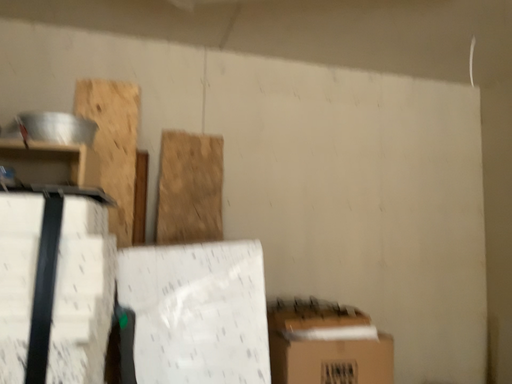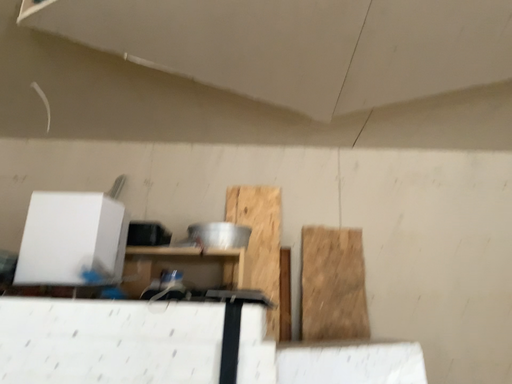
Question: How did the camera likely rotate when shooting the video?

Choices:
 (A) rotated downward
 (B) rotated upward

Answer: (B)